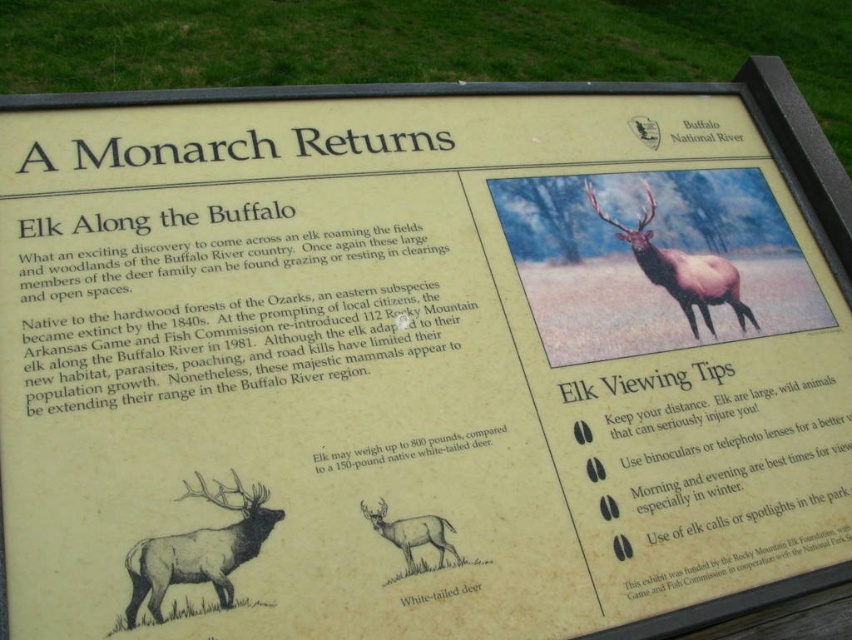
Question: Is brown sketchy elk at lower left closer to the viewer compared to shiny brown elk at center?

Choices:
 (A) no
 (B) yes

Answer: (B)

Question: Which object is the closest to the brown sketchy elk at lower left?

Choices:
 (A) shiny brown elk at center
 (B) brown sketchy deer at center

Answer: (B)

Question: Which object is closer to the camera taking this photo?

Choices:
 (A) brown sketchy deer at center
 (B) shiny brown elk at center

Answer: (A)

Question: Does brown sketchy elk at lower left lie in front of shiny brown elk at center?

Choices:
 (A) yes
 (B) no

Answer: (A)

Question: Which of the following is the farthest from the observer?

Choices:
 (A) (692, 292)
 (B) (225, 502)

Answer: (A)

Question: Is brown sketchy elk at lower left in front of shiny brown elk at center?

Choices:
 (A) no
 (B) yes

Answer: (B)